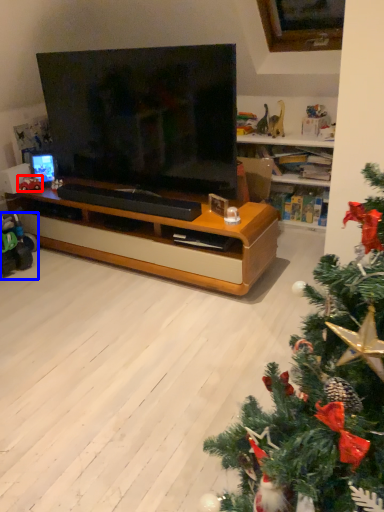
Question: Which point is closer to the camera, toy (highlighted by a red box) or toy (highlighted by a blue box)?

Choices:
 (A) toy
 (B) toy

Answer: (B)